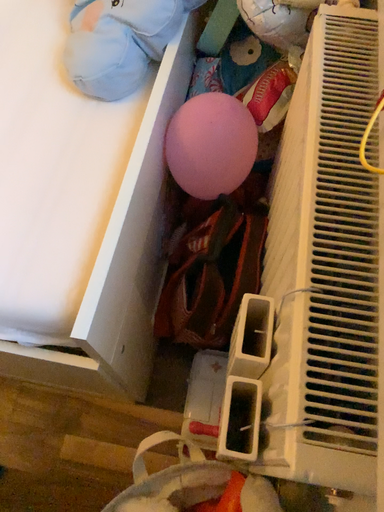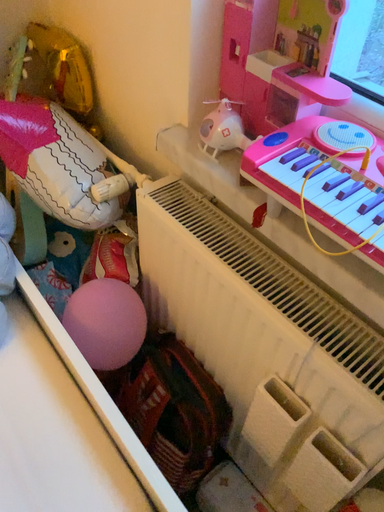
Question: How did the camera likely rotate when shooting the video?

Choices:
 (A) rotated right
 (B) rotated left

Answer: (A)